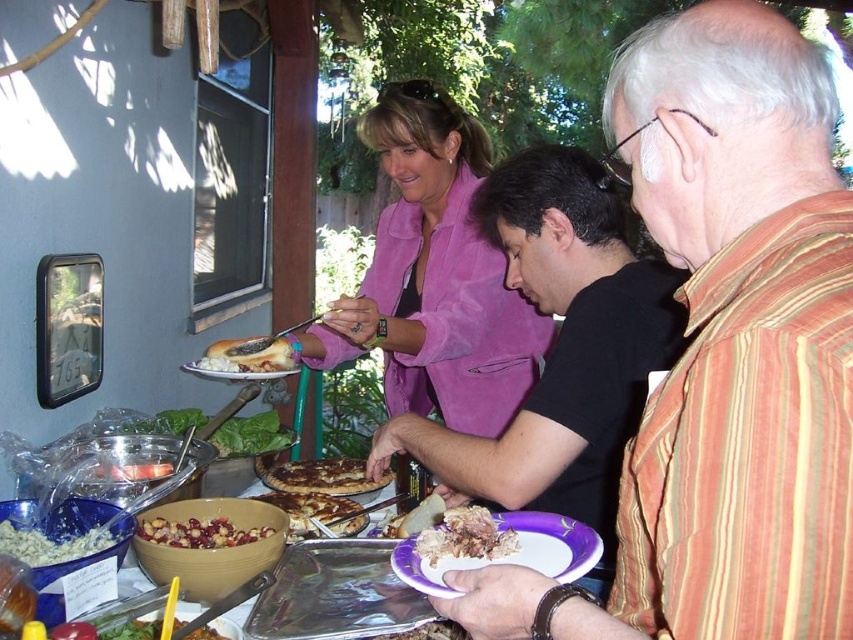
You are planning to place the crumbly brown bread at center and the shiny brown bowl at lower left on a shelf. Which item requires more horizontal space on the shelf?

The shiny brown bowl at lower left requires more horizontal space because it has a greater width than the crumbly brown bread at center.

You are a photographer trying to capture a candid shot of the striped cotton shirt at center and the pink suede jacket at upper center. Since you want to ensure both are clearly visible, which clothing item should you focus on to avoid blurring due to their size?

The striped cotton shirt at center has a smaller size compared to the pink suede jacket at upper center. To avoid blurring, focus on the pink suede jacket at upper center since it is larger and easier to capture clearly.